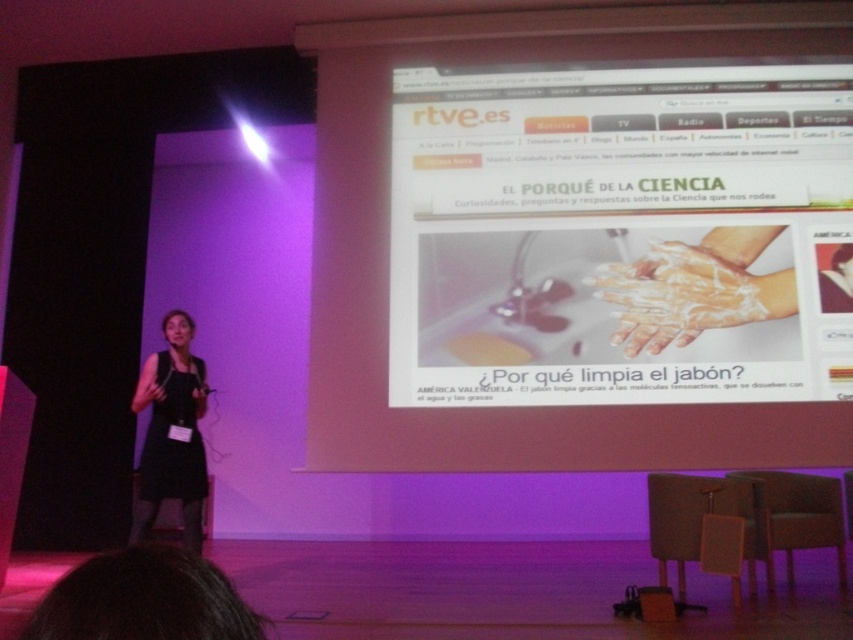
Is white foamy hands at center to the right of black fabric dress at lower left from the viewer's perspective?

Indeed, white foamy hands at center is positioned on the right side of black fabric dress at lower left.

Is white foamy hands at center thinner than black fabric dress at lower left?

No.

What do you see at coordinates (688, 289) in the screenshot? I see `white foamy hands at center` at bounding box center [688, 289].

Where is `white foamy hands at center`? The image size is (853, 640). white foamy hands at center is located at coordinates (688, 289).

Is point (811, 125) closer to viewer compared to point (709, 240)?

No, (811, 125) is behind (709, 240).

The height and width of the screenshot is (640, 853). I want to click on white glossy webpage at upper center, so click(621, 234).

Which is in front, point (424, 70) or point (778, 275)?

Point (778, 275) is in front.

Find the location of a particular element. The height and width of the screenshot is (640, 853). white glossy webpage at upper center is located at coordinates (621, 234).

Does point (556, 346) lie behind point (167, 490)?

Yes, point (556, 346) is farther from viewer.

Is white glossy webpage at upper center closer to the viewer compared to black fabric dress at lower left?

No, it is not.

Between point (506, 250) and point (149, 417), which one is positioned in front?

Positioned in front is point (506, 250).

At what (x,y) coordinates should I click in order to perform the action: click on white glossy webpage at upper center. Please return your answer as a coordinate pair (x, y). Looking at the image, I should click on (621, 234).